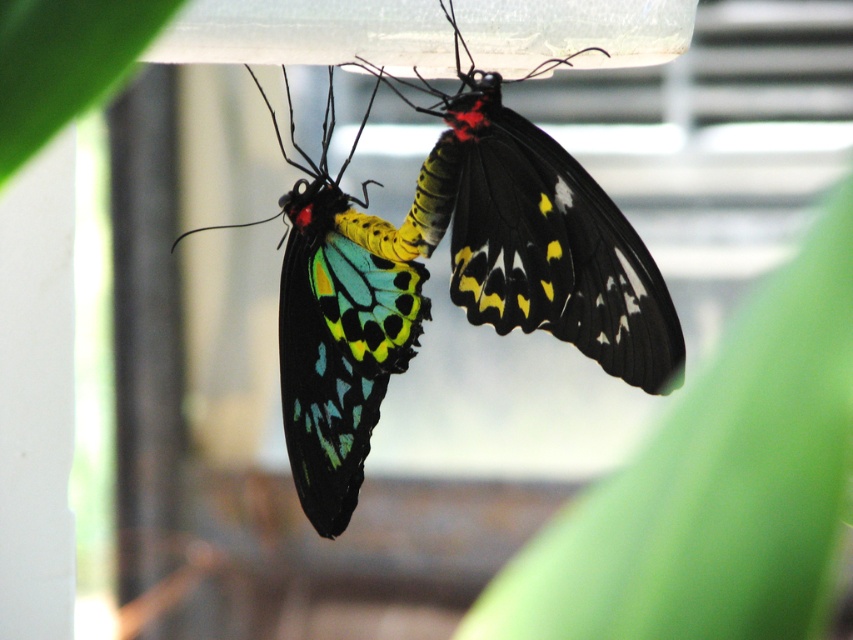
Question: Can you confirm if shiny iridescent wings at center is bigger than green leafy plant at upper left?

Choices:
 (A) no
 (B) yes

Answer: (B)

Question: Estimate the real-world distances between objects in this image. Which object is farther from the green leafy plant at upper left?

Choices:
 (A) shiny iridescent wings at center
 (B) multicolored iridescent wings at center
 (C) green matte leaf at upper right

Answer: (A)

Question: Among these points, which one is nearest to the camera?

Choices:
 (A) (372, 355)
 (B) (535, 323)

Answer: (B)

Question: Is green matte leaf at upper right closer to camera compared to green leafy plant at upper left?

Choices:
 (A) no
 (B) yes

Answer: (B)

Question: Which of these objects is positioned farthest from the multicolored iridescent wings at center?

Choices:
 (A) green matte leaf at upper right
 (B) shiny iridescent wings at center
 (C) green leafy plant at upper left

Answer: (C)

Question: Is multicolored iridescent wings at center below green leafy plant at upper left?

Choices:
 (A) yes
 (B) no

Answer: (A)